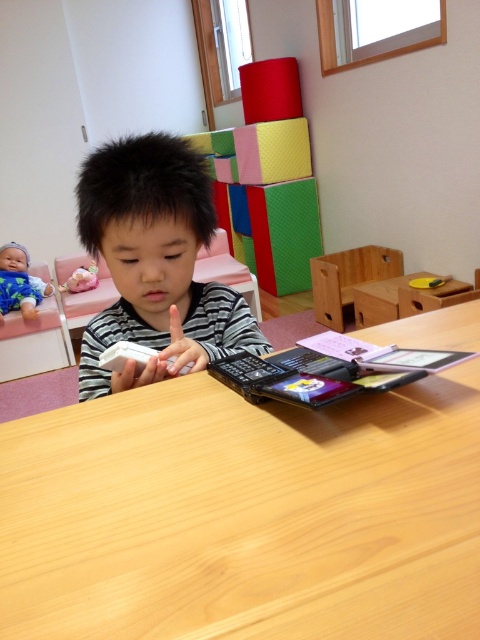
What are the coordinates of the black striped shirt at center?

The black striped shirt at center is located at point (155, 262).

You are a fashion designer analyzing the image. You need to determine the position of the black striped shirt at center in the image. What are its coordinates?

The coordinates of the black striped shirt at center are at point (155,262).

Based on the scene description, which object is wider, the black striped shirt at center or the blue fabric baby doll at upper left?

The black striped shirt at center is wider than the blue fabric baby doll at upper left according to the description.